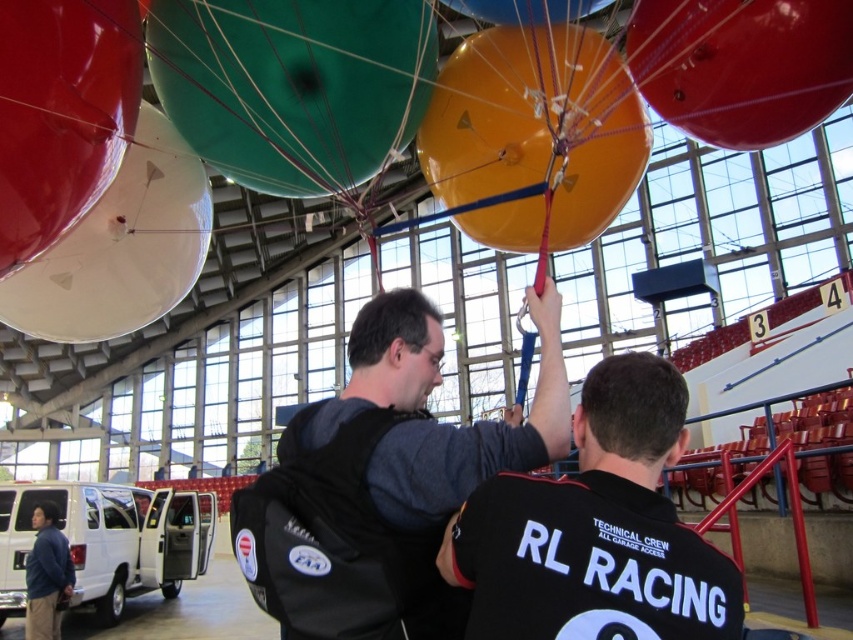
Is shiny metallic balloon at upper left taller than blue fabric jacket at lower left?

In fact, shiny metallic balloon at upper left may be shorter than blue fabric jacket at lower left.

Is shiny metallic balloon at upper left wider than blue fabric jacket at lower left?

No, shiny metallic balloon at upper left is not wider than blue fabric jacket at lower left.

Is point (61, 186) positioned before point (56, 541)?

Yes, point (61, 186) is in front of point (56, 541).

Where is `shiny metallic balloon at upper left`? Image resolution: width=853 pixels, height=640 pixels. shiny metallic balloon at upper left is located at coordinates (61, 113).

Does black jersey at center appear on the left side of orange glossy balloon at center?

Yes, black jersey at center is to the left of orange glossy balloon at center.

Looking at this image, how far apart are black jersey at center and orange glossy balloon at center?

The distance of black jersey at center from orange glossy balloon at center is 12.52 feet.

Is point (480, 621) positioned behind point (486, 147)?

No, (480, 621) is closer to viewer.

In order to click on black jersey at center in this screenshot , I will do `click(596, 529)`.

Between black fabric backpack at center and white glossy balloon at upper left, which one has less height?

black fabric backpack at center

Does black fabric backpack at center have a lesser width compared to white glossy balloon at upper left?

Yes, black fabric backpack at center is thinner than white glossy balloon at upper left.

Between point (410, 470) and point (157, 234), which one is positioned behind?

The point (157, 234) is behind.

Find the location of a particular element. The image size is (853, 640). black fabric backpack at center is located at coordinates (473, 440).